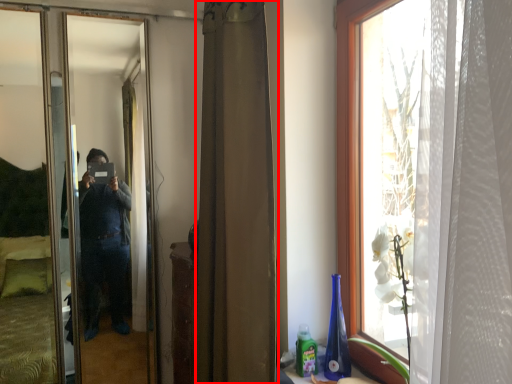
Question: In this image, where is curtain (annotated by the red box) located relative to mirror?

Choices:
 (A) left
 (B) right

Answer: (B)